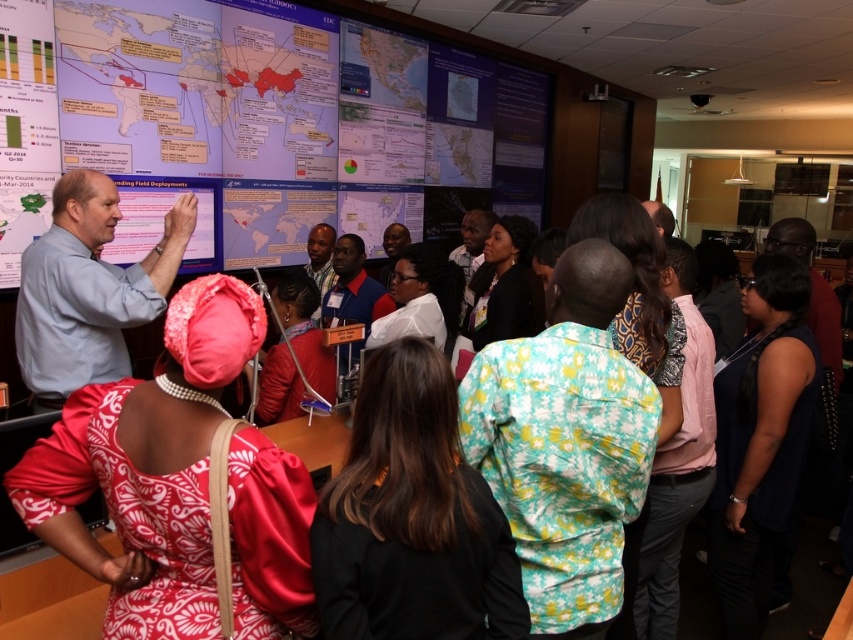
You are sitting at the back of the conference room and want to see both the presenter and the screen clearly. Which of the two points, point (x=51, y=54) or point (x=306, y=524), is closer to you?

Point (x=51, y=54) is closer to you because it is further to the viewer compared to point (x=306, y=524).

You are an attendee at the presentation and want to take a photo of the matte white board at upper left without including the silky red dress at center in the frame. Is this possible based on their positions?

Yes, because the matte white board at upper left is closer to you than the silky red dress at center, you can position yourself to capture the board without the dress in the frame.